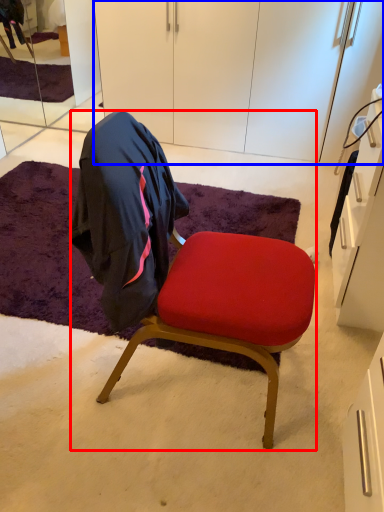
Question: Among these objects, which one is farthest to the camera, chair (highlighted by a red box) or cabinetry (highlighted by a blue box)?

Choices:
 (A) chair
 (B) cabinetry

Answer: (B)